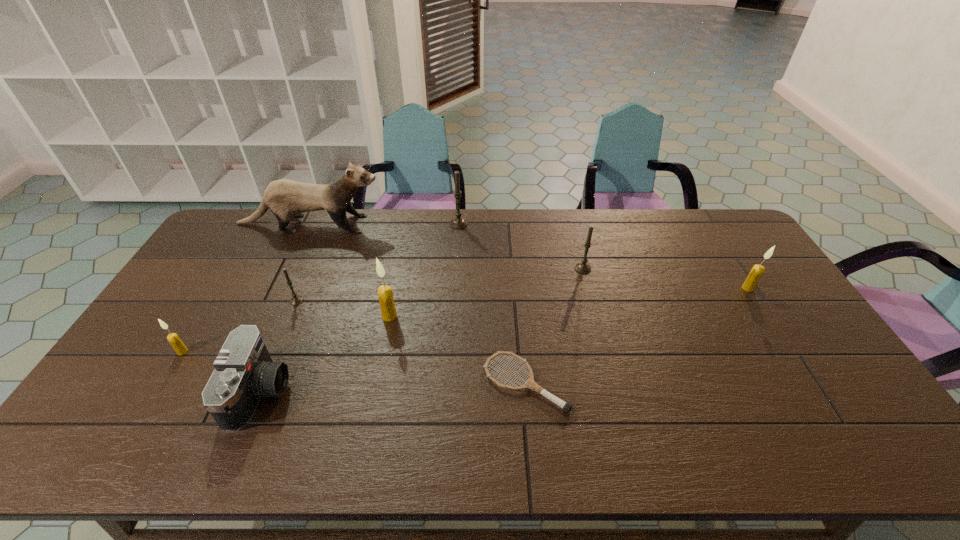
At what (x,y) coordinates should I click in order to perform the action: click on object that is at the right edge. Please return your answer as a coordinate pair (x, y). Image resolution: width=960 pixels, height=540 pixels. Looking at the image, I should click on (756, 272).

What are the coordinates of `object positioned at the far left corner` in the screenshot? It's located at (285, 198).

Identify the location of free point at the far edge. Image resolution: width=960 pixels, height=540 pixels. (425, 232).

At what (x,y) coordinates should I click in order to perform the action: click on vacant position at the left edge of the desktop. Please return your answer as a coordinate pair (x, y). Looking at the image, I should click on (174, 303).

In the image, there is a desktop. In order to click on vacant region at the right edge in this screenshot , I will do `click(776, 318)`.

The width and height of the screenshot is (960, 540). What are the coordinates of `unoccupied area between the seventh object from left to right and the black camera` in the screenshot? It's located at (393, 387).

Image resolution: width=960 pixels, height=540 pixels. Identify the location of unoccupied position between the camera and the third candle from right to left. (360, 308).

Find the location of a particular element. This screenshot has width=960, height=540. free spot between the shortest object and the smallest gray candle is located at coordinates (411, 342).

Locate an element on the screen. This screenshot has height=540, width=960. free space between the gray tennis racket and the black camera is located at coordinates (393, 387).

What are the coordinates of `free spot between the leftmost candle and the gray tennis racket` in the screenshot? It's located at (354, 368).